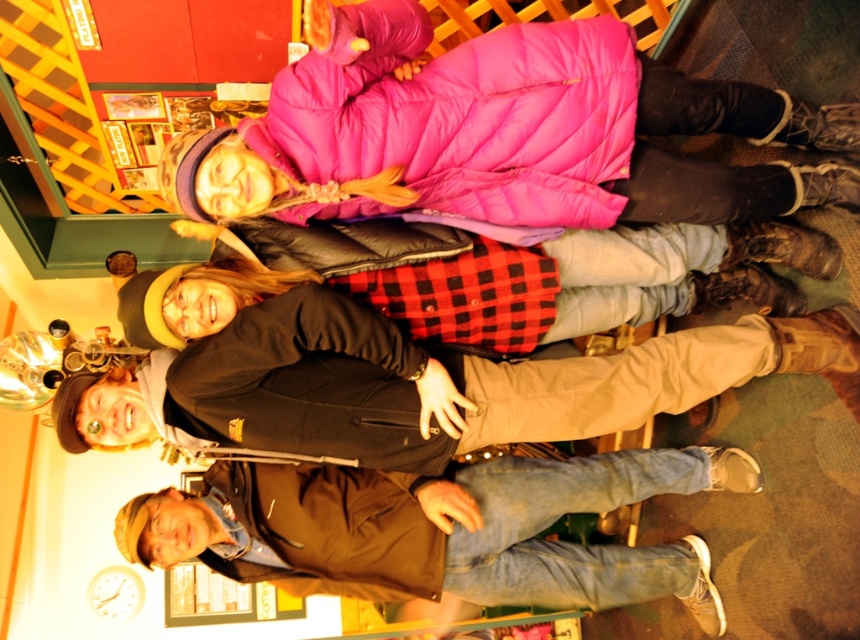
You are trying to locate the pink puffy coat at upper center and the black quilted jacket at upper center in the image. Which one is positioned to the right side?

The pink puffy coat at upper center is to the right of the black quilted jacket at upper center.